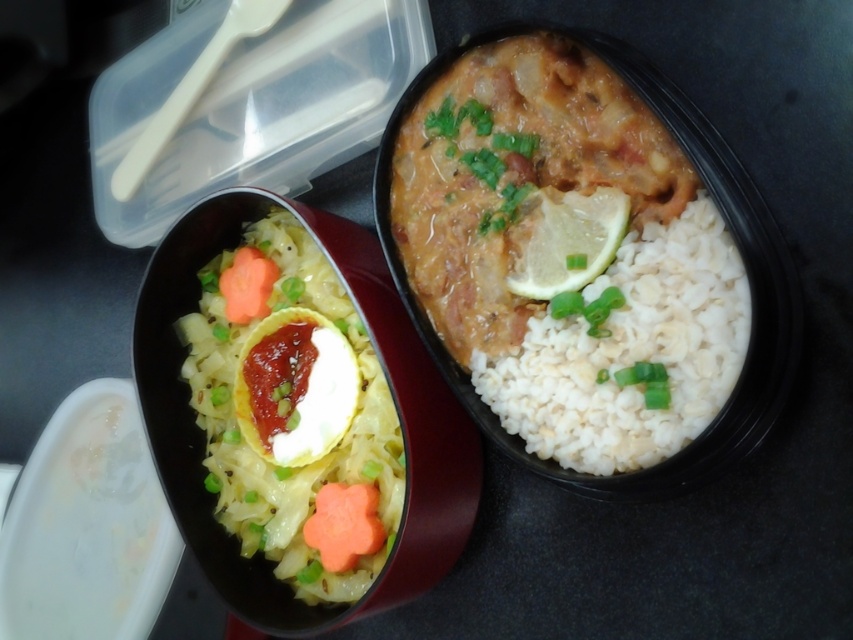
Question: Is white creamy rice at lower left positioned at the back of white matte rice at center?

Choices:
 (A) no
 (B) yes

Answer: (B)

Question: Where is yellow matte lemon at upper right located in relation to green leafy vegetable at center in the image?

Choices:
 (A) left
 (B) right

Answer: (B)

Question: Can you confirm if yellow matte lemon at upper right is positioned below green leafy vegetable at center?

Choices:
 (A) no
 (B) yes

Answer: (B)

Question: Among these points, which one is nearest to the camera?

Choices:
 (A) (560, 278)
 (B) (695, 364)
 (C) (606, 307)
 (D) (213, 257)

Answer: (B)

Question: Which point appears closest to the camera in this image?

Choices:
 (A) (537, 145)
 (B) (543, 378)
 (C) (584, 310)
 (D) (555, 224)

Answer: (C)

Question: Which point is closer to the camera?

Choices:
 (A) (593, 326)
 (B) (543, 253)
 (C) (383, 424)
 (D) (488, 365)

Answer: (A)